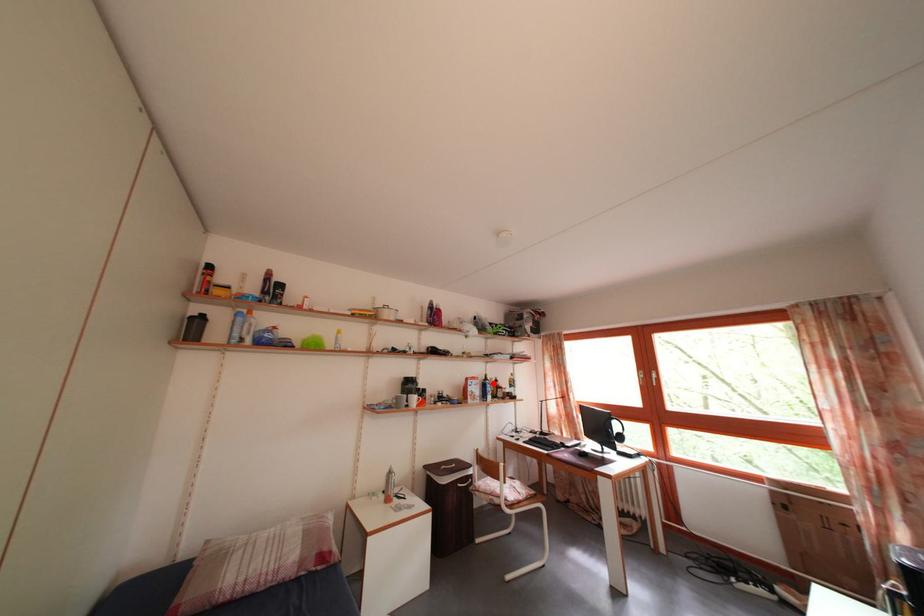
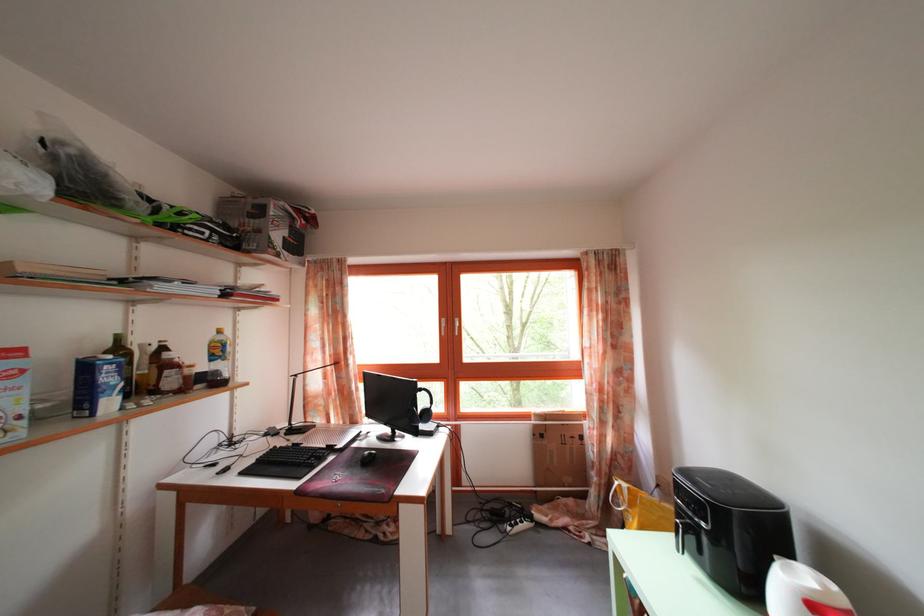
Where in the second image is the point corresponding to the highlighted location from the first image?

(126, 346)